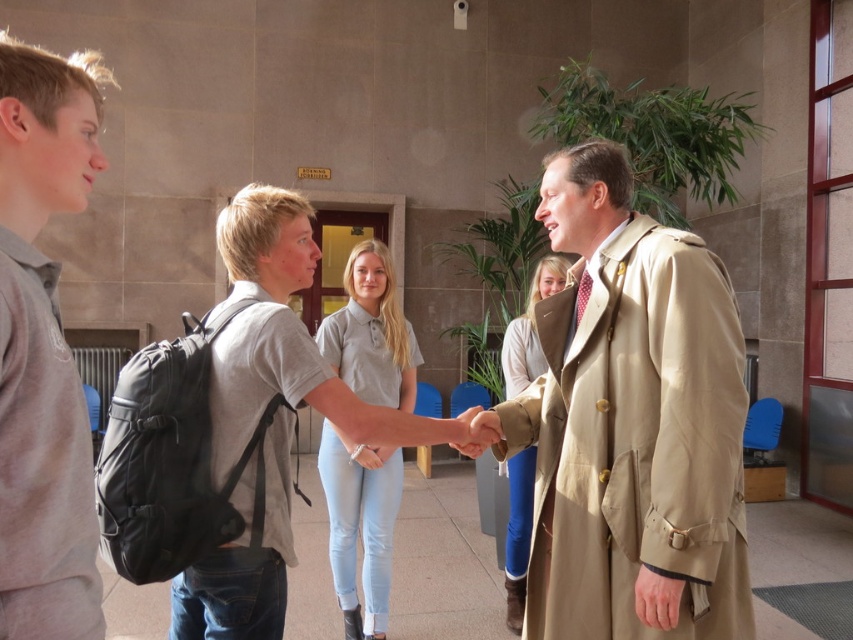
Question: Which is farther from the tan leather trench coat at center?

Choices:
 (A) gray cotton polo shirt at center
 (B) gray matte shirt at left
 (C) light beige coat at center

Answer: (C)

Question: Does tan leather trench coat at center have a larger size compared to gray matte shirt at left?

Choices:
 (A) yes
 (B) no

Answer: (A)

Question: Which point is closer to the camera?

Choices:
 (A) tan leather trench coat at center
 (B) gray matte shirt at left
 (C) gray cotton polo shirt at center

Answer: (B)

Question: Is gray cotton polo shirt at center positioned behind light beige coat at center?

Choices:
 (A) yes
 (B) no

Answer: (B)

Question: Which object is positioned closest to the gray matte shirt at left?

Choices:
 (A) gray cotton polo shirt at center
 (B) tan leather trench coat at center
 (C) light beige coat at center

Answer: (B)

Question: Is gray matte shirt at left smaller than light gray cotton t-shirt at center?

Choices:
 (A) yes
 (B) no

Answer: (A)